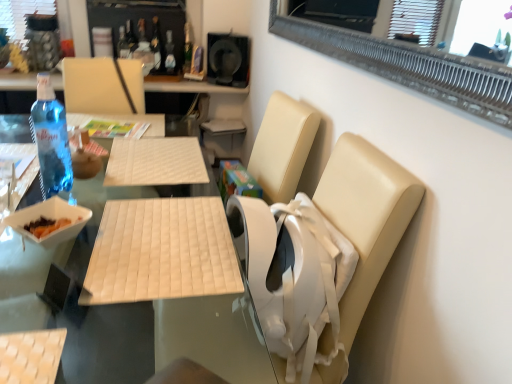
Where is `free spot above white quilted mat at center, marked as the first table in a top-to-bottom arrangement (from a real-world perspective)`? This screenshot has height=384, width=512. free spot above white quilted mat at center, marked as the first table in a top-to-bottom arrangement (from a real-world perspective) is located at coordinates (163, 238).